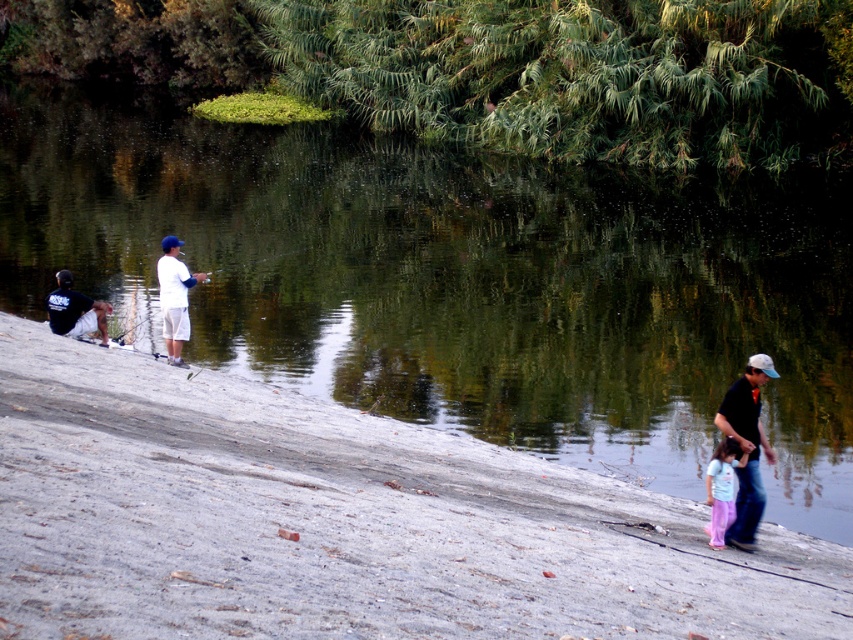
Based on the photo, you are observing two points in the riverside scene. The first point is at coordinates point [36,532] and the second point is at point [756,449]. Which of these two points is closer to your viewpoint?

Point [36,532] is closer to the camera than point [756,449].